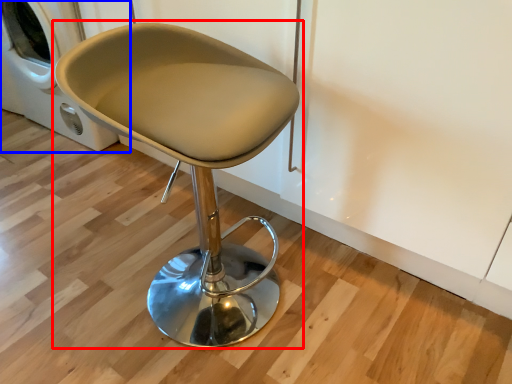
Question: Which point is further to the camera, chair (highlighted by a red box) or washing machine (highlighted by a blue box)?

Choices:
 (A) chair
 (B) washing machine

Answer: (B)